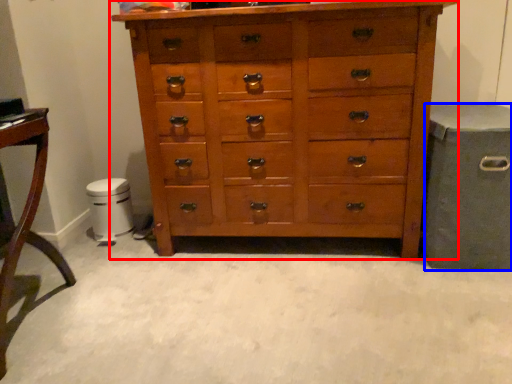
Question: Which of the following is the closest to the observer, chest of drawers (highlighted by a red box) or gray (highlighted by a blue box)?

Choices:
 (A) chest of drawers
 (B) gray

Answer: (A)